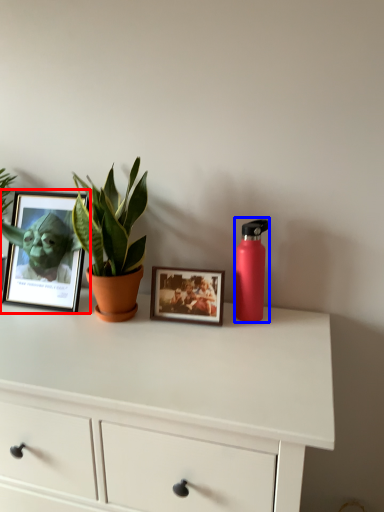
Question: Among these objects, which one is farthest to the camera, picture frame (highlighted by a red box) or bottle (highlighted by a blue box)?

Choices:
 (A) picture frame
 (B) bottle

Answer: (A)